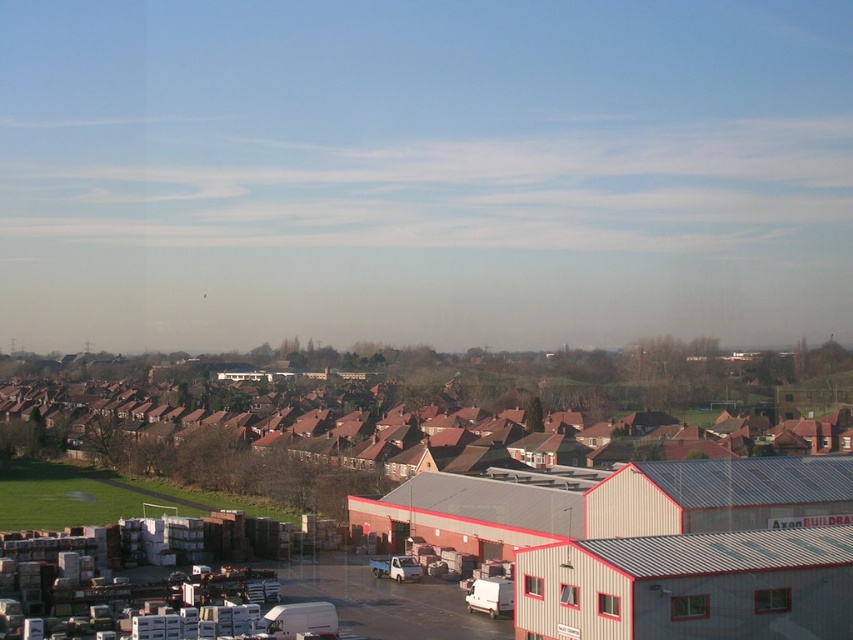
Question: Does brown tiled roofs at center appear under white matte truck at center?

Choices:
 (A) no
 (B) yes

Answer: (A)

Question: Which object appears farthest from the camera in this image?

Choices:
 (A) brown tiled roofs at center
 (B) white matte truck at center

Answer: (A)

Question: Can you confirm if white corrugated metal warehouse at center is positioned below brown tiled roofs at center?

Choices:
 (A) yes
 (B) no

Answer: (A)

Question: Which point is closer to the camera?

Choices:
 (A) (126, 388)
 (B) (337, 435)
 (C) (415, 561)

Answer: (C)

Question: Which point appears closest to the camera in this image?

Choices:
 (A) (234, 477)
 (B) (407, 570)

Answer: (B)

Question: Does brown tiled roofs at center have a lesser width compared to white matte truck at center?

Choices:
 (A) yes
 (B) no

Answer: (B)